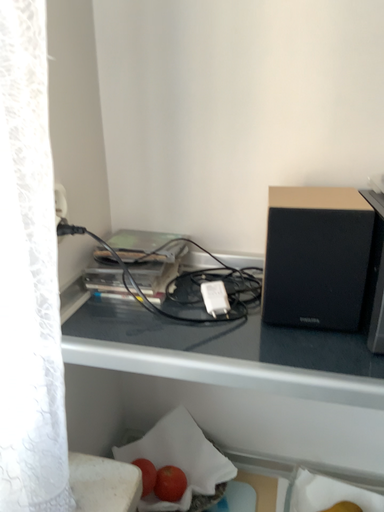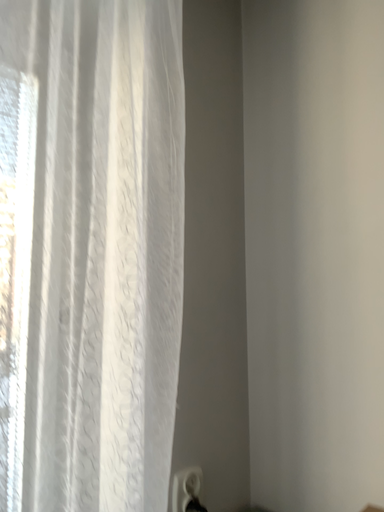
Question: Which way did the camera rotate in the video?

Choices:
 (A) rotated downward
 (B) rotated upward

Answer: (B)